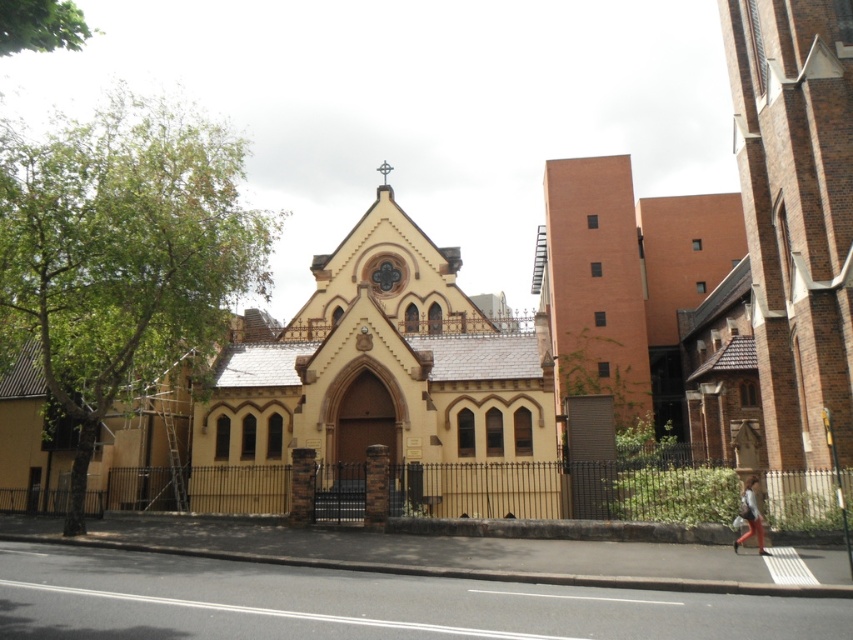
You are standing in front of the historic church building. There is a point marked at coordinates (380, 387). What is located at this point?

The point at coordinates (380, 387) marks the location of the matte yellow chapel at center.

You are standing at the entrance of the historic church building. You want to locate the matte yellow chapel at center. According to the coordinates provided, in which direction should you walk to find it?

The matte yellow chapel at center is located at coordinates point (380, 387), so you should walk towards the center of the image to find it.

You are a delivery person standing at the location of the denim pants at lower right. You need to deliver a package to the brick wall building at center. Given that your delivery cart can only move in a straight line and has a maximum range of 80 meters, will you be able to reach the building directly without needing to adjust your route?

→ The distance between the brick wall building at center and denim pants at lower right is 78.32 meters. Since the delivery cart can travel up to 80 meters in a straight line, you can reach the building directly without adjusting your route.